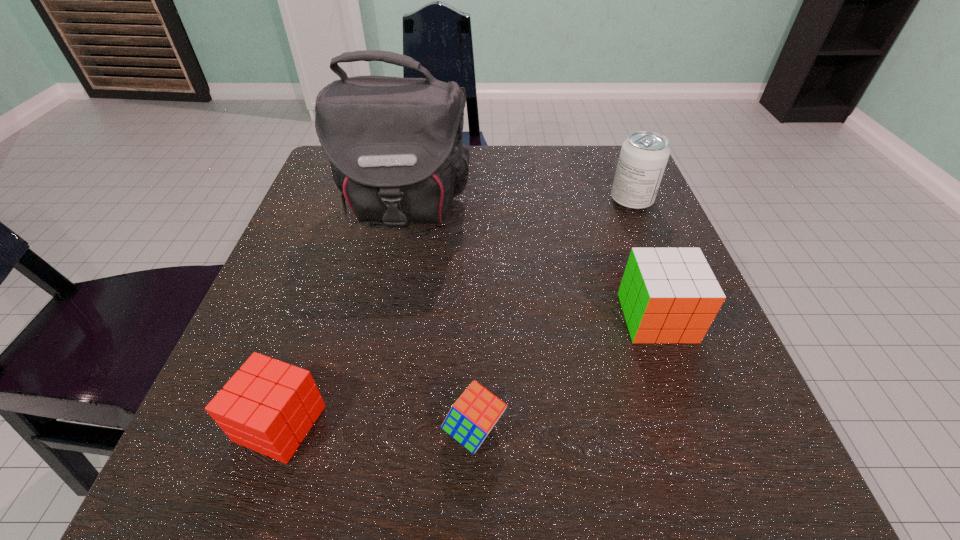
Where is `vacant point located between the second cube from right to left and the tallest object`? vacant point located between the second cube from right to left and the tallest object is located at coordinates (439, 319).

Find the location of `empty location between the shortest cube and the tallest cube`. empty location between the shortest cube and the tallest cube is located at coordinates (565, 374).

Locate an element on the screen. The width and height of the screenshot is (960, 540). blank region between the tallest cube and the shortest cube is located at coordinates (x=565, y=374).

The image size is (960, 540). I want to click on vacant point located between the tallest cube and the second cube from left to right, so click(565, 374).

The width and height of the screenshot is (960, 540). I want to click on free spot between the leftmost cube and the shortest cube, so click(377, 427).

The height and width of the screenshot is (540, 960). In order to click on free space between the shoulder bag and the shortest object in this screenshot , I will do `click(439, 319)`.

Where is `object that is the closest one to the shortest object`? object that is the closest one to the shortest object is located at coordinates (269, 406).

Locate an element on the screen. The image size is (960, 540). object that ranks as the second closest to the rightmost cube is located at coordinates (643, 158).

This screenshot has height=540, width=960. Find the location of `cube that is the closest to the shoulder bag`. cube that is the closest to the shoulder bag is located at coordinates (668, 295).

Locate an element on the screen. The width and height of the screenshot is (960, 540). the second closest cube to the shoulder bag is located at coordinates (269, 406).